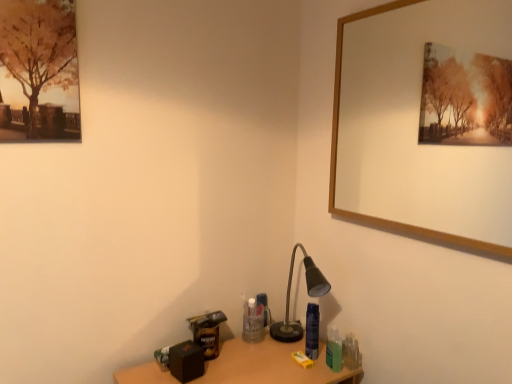
What do you see at coordinates (308, 294) in the screenshot?
I see `matte black desk lamp at lower right` at bounding box center [308, 294].

Locate an element on the screen. wooden picture frame at upper right is located at coordinates (426, 121).

Is wooden picture frame at upper right positioned with its back to wooden table at lower center?

No, wooden picture frame at upper right is not facing the opposite direction of wooden table at lower center.

Which is less distant, (386,24) or (272,355)?

The point (272,355) is closer to the camera.

Does wooden picture frame at upper right have a larger size compared to wooden table at lower center?

No, wooden picture frame at upper right is not bigger than wooden table at lower center.

From the picture: Is wooden picture frame at upper right positioned beyond the bounds of wooden table at lower center?

Indeed, wooden picture frame at upper right is completely outside wooden table at lower center.

Can you confirm if matte black desk lamp at lower right is thinner than wooden picture frame at upper right?

In fact, matte black desk lamp at lower right might be wider than wooden picture frame at upper right.

From the image's perspective, which one is positioned higher, matte black desk lamp at lower right or wooden picture frame at upper right?

From the image's view, wooden picture frame at upper right is above.

Based on their positions, is matte black desk lamp at lower right located to the left or right of wooden picture frame at upper right?

Clearly, matte black desk lamp at lower right is on the left of wooden picture frame at upper right in the image.

How many degrees apart are the facing directions of matte black desk lamp at lower right and wooden picture frame at upper right?

79.1 degrees separate the facing orientations of matte black desk lamp at lower right and wooden picture frame at upper right.

Which object is positioned more to the left, wooden picture frame at upper right or matte black desk lamp at lower right?

Positioned to the left is matte black desk lamp at lower right.

From the image's perspective, is wooden picture frame at upper right above or below matte black desk lamp at lower right?

From the image's perspective, wooden picture frame at upper right appears above matte black desk lamp at lower right.

Can you tell me how much wooden picture frame at upper right and matte black desk lamp at lower right differ in facing direction?

79.1 degrees.

Consider the image. Is the depth of wooden table at lower center greater than that of wooden picture frame at upper right?

Yes, wooden table at lower center is further from the viewer.

Is wooden table at lower center not near wooden picture frame at upper right?

Indeed, wooden table at lower center is not near wooden picture frame at upper right.

This screenshot has width=512, height=384. In order to click on picture frame that appears above the wooden table at lower center (from a real-world perspective) in this screenshot , I will do `click(426, 121)`.

Can you tell me how much wooden table at lower center and wooden picture frame at upper right differ in facing direction?

The facing directions of wooden table at lower center and wooden picture frame at upper right are 90.5 degrees apart.

Between matte black desk lamp at lower right and wooden table at lower center, which one appears on the right side from the viewer's perspective?

matte black desk lamp at lower right is more to the right.

Does point (278, 328) lie in front of point (298, 371)?

No.

From the picture: Which of these two, matte black desk lamp at lower right or wooden table at lower center, is smaller?

With smaller size is matte black desk lamp at lower right.

Do you think matte black desk lamp at lower right is within wooden table at lower center, or outside of it?

The correct answer is: outside.

Is wooden table at lower center bigger or smaller than matte black desk lamp at lower right?

Clearly, wooden table at lower center is larger in size than matte black desk lamp at lower right.

Which object is positioned more to the right, wooden table at lower center or matte black desk lamp at lower right?

From the viewer's perspective, matte black desk lamp at lower right appears more on the right side.

Between point (261, 357) and point (290, 263), which one is positioned in front?

The point (261, 357) is more forward.

Locate an element on the screen. table to the left of wooden picture frame at upper right is located at coordinates (269, 365).

What are the coordinates of `picture frame positioned vertically above the matte black desk lamp at lower right (from a real-world perspective)` in the screenshot? It's located at (426, 121).

From the image, which object appears to be farther from wooden picture frame at upper right, wooden table at lower center or matte black desk lamp at lower right?

The object further to wooden picture frame at upper right is wooden table at lower center.

Looking at the image, which one is located closer to wooden table at lower center, wooden picture frame at upper right or matte black desk lamp at lower right?

matte black desk lamp at lower right is closer to wooden table at lower center.

Which object lies nearer to the anchor point matte black desk lamp at lower right, wooden table at lower center or wooden picture frame at upper right?

Based on the image, wooden table at lower center appears to be nearer to matte black desk lamp at lower right.

Looking at this image, based on their spatial positions, is matte black desk lamp at lower right or wooden table at lower center further from wooden picture frame at upper right?

wooden table at lower center is further to wooden picture frame at upper right.

From the picture: Which object lies further to the anchor point matte black desk lamp at lower right, wooden picture frame at upper right or wooden table at lower center?

wooden picture frame at upper right is further to matte black desk lamp at lower right.

When comparing their distances from wooden table at lower center, does matte black desk lamp at lower right or wooden picture frame at upper right seem closer?

Based on the image, matte black desk lamp at lower right appears to be nearer to wooden table at lower center.

Find the location of a particular element. The width and height of the screenshot is (512, 384). lamp between wooden picture frame at upper right and wooden table at lower center in the vertical direction is located at coordinates (308, 294).